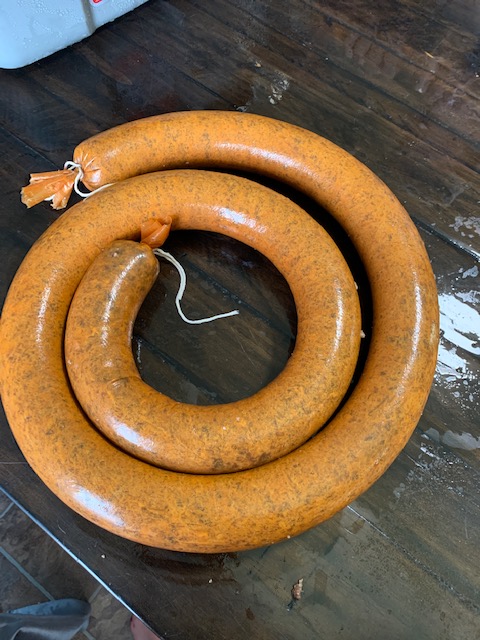
What are the coordinates of `floor` in the screenshot? It's located at (70, 573).